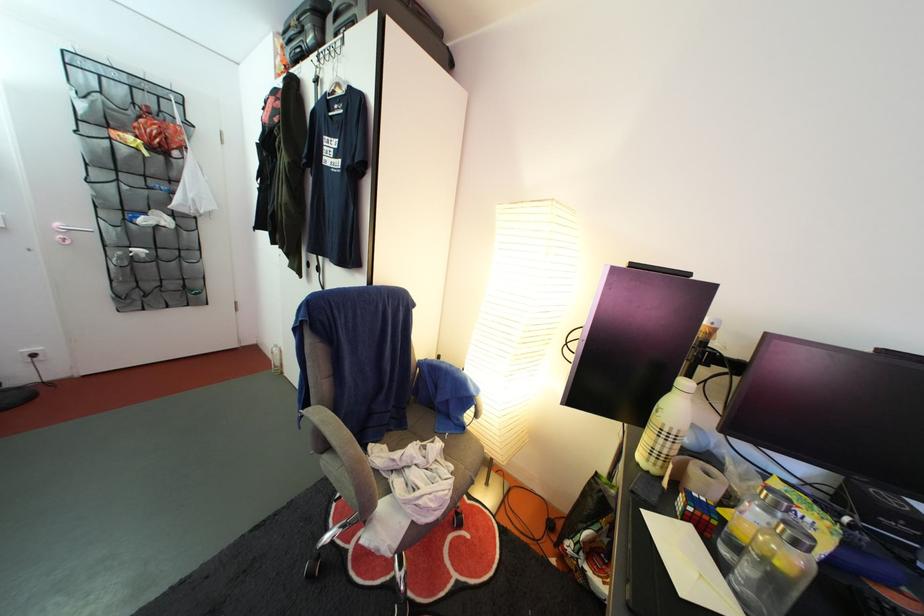
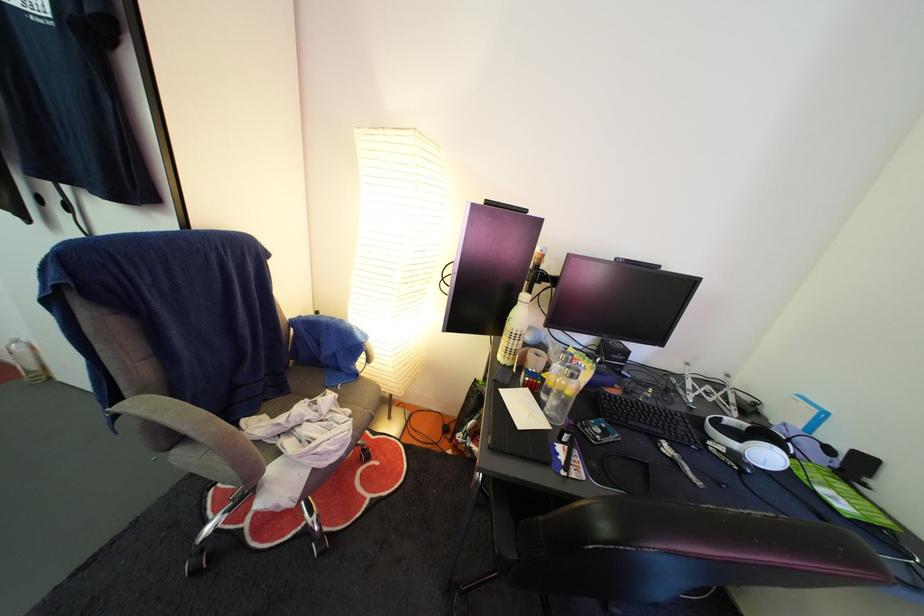
Locate, in the second image, the point that corresponds to point (714, 525) in the first image.

(543, 390)